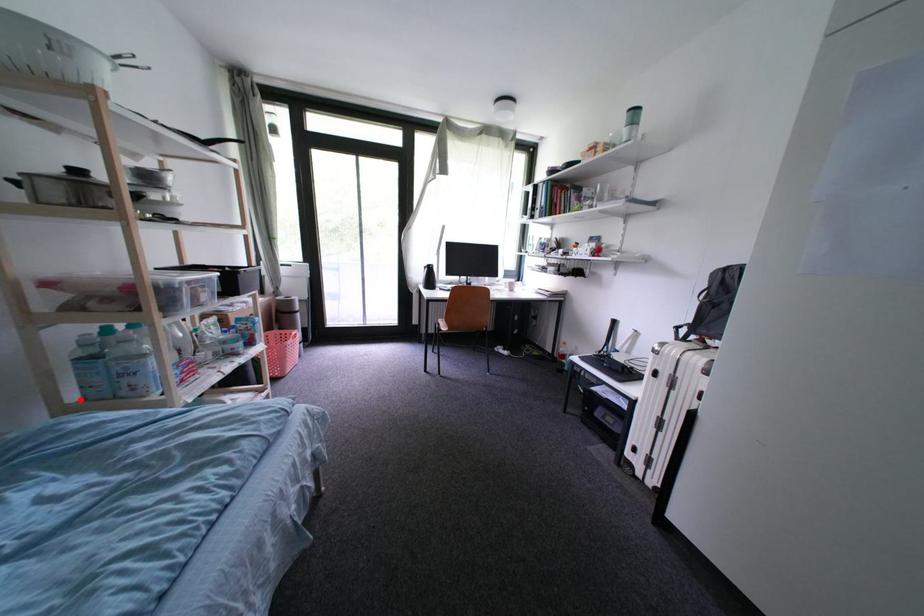
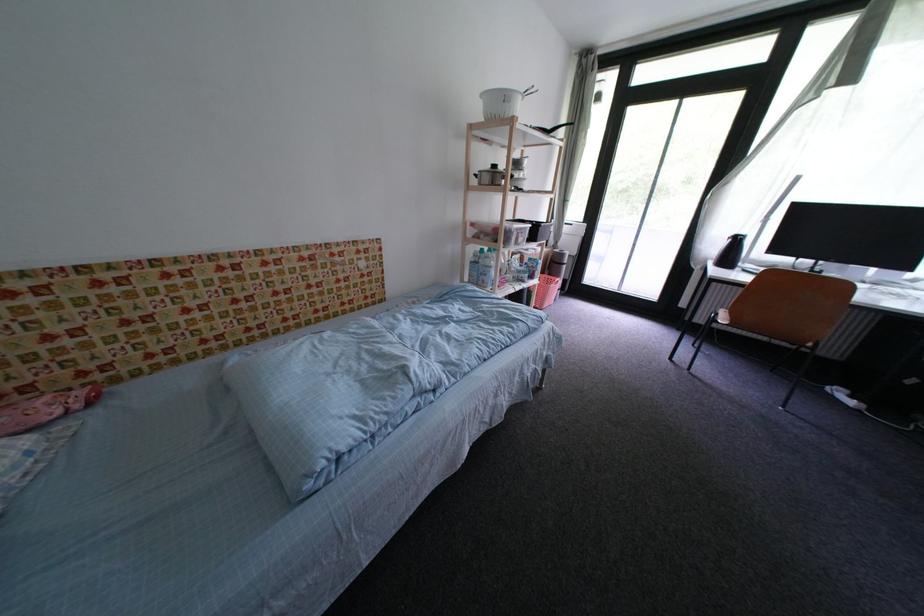
Question: I am providing you with two images of the same scene from different viewpoints. Given a red point in image1, look at the same physical point in image2. Is it:

Choices:
 (A) Closer to the viewpoint
 (B) Farther from the viewpoint

Answer: (A)